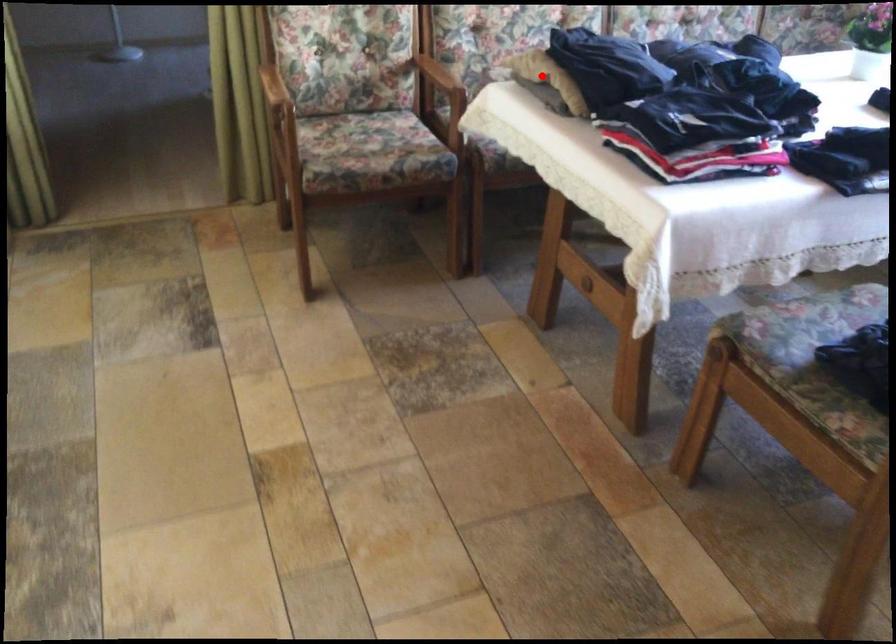
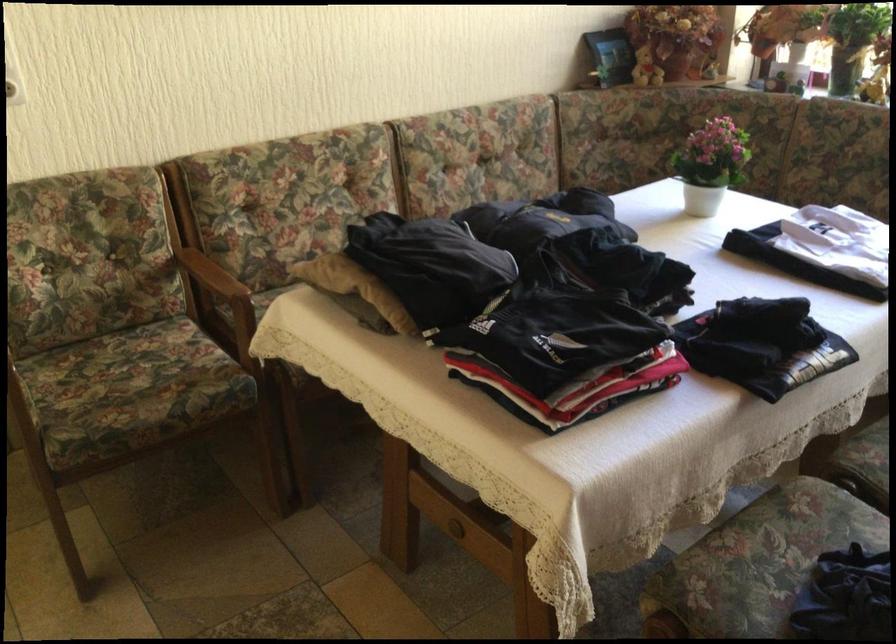
Locate, in the second image, the point that corresponds to the highlighted location in the first image.

(355, 287)